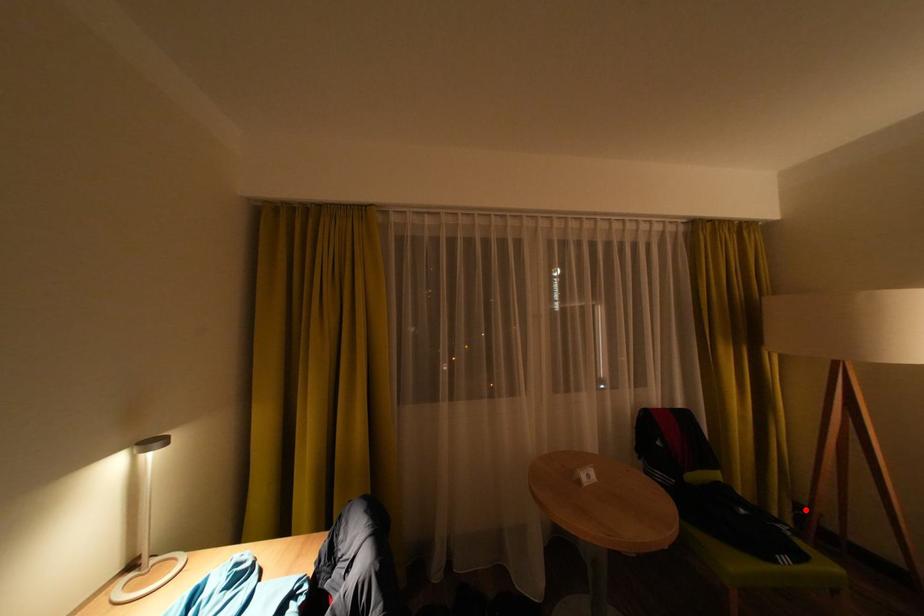
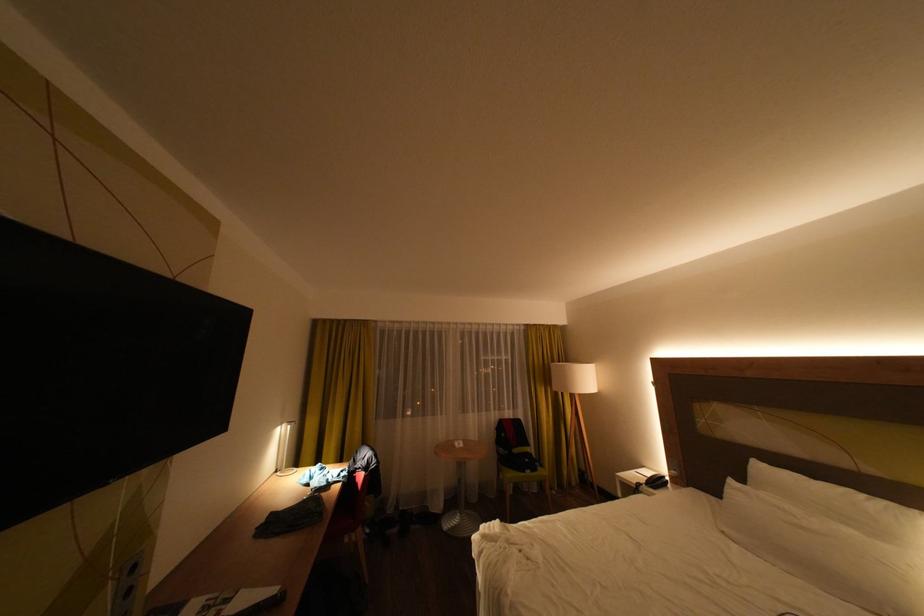
Question: I am providing you with two images of the same scene from different viewpoints. In image1, a red point is highlighted. Considering the same 3D point in image2, which of the following is correct?

Choices:
 (A) It is closer
 (B) It is farther

Answer: (B)